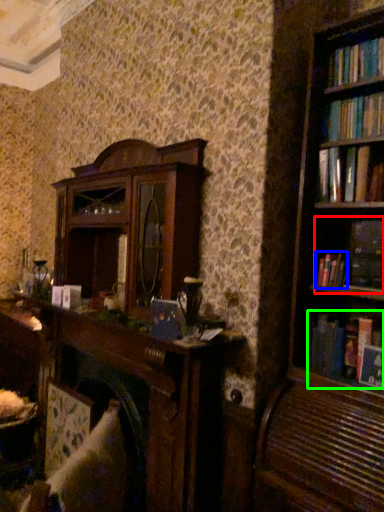
Question: Which is farther away from book (highlighted by a red box)? book (highlighted by a blue box) or book (highlighted by a green box)?

Choices:
 (A) book
 (B) book

Answer: (B)